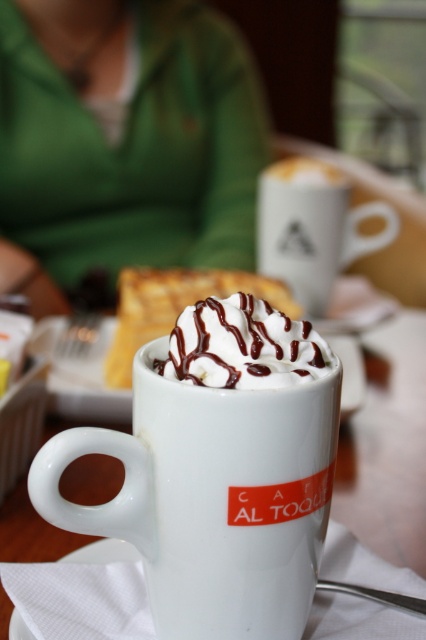
Question: From the image, what is the correct spatial relationship of white ceramic mug at center in relation to white matte mug at center?

Choices:
 (A) right
 (B) left

Answer: (B)

Question: Which of these objects is positioned closest to the white matte mug at center?

Choices:
 (A) whipped cream at center
 (B) white ceramic mug at center
 (C) green fabric at upper center

Answer: (C)

Question: Can you confirm if white matte mug at center is smaller than whipped cream at center?

Choices:
 (A) yes
 (B) no

Answer: (B)

Question: Which object appears closest to the camera in this image?

Choices:
 (A) whipped cream at center
 (B) white matte mug at center

Answer: (A)

Question: Among these objects, which one is nearest to the camera?

Choices:
 (A) white matte mug at center
 (B) white ceramic mug at center

Answer: (B)

Question: Is white ceramic mug at center bigger than white matte mug at center?

Choices:
 (A) yes
 (B) no

Answer: (B)